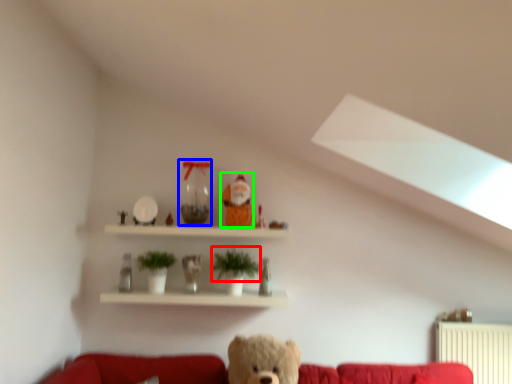
Question: Which is farther away from plant (highlighted by a red box)? glass vase (highlighted by a blue box) or toy (highlighted by a green box)?

Choices:
 (A) glass vase
 (B) toy

Answer: (A)